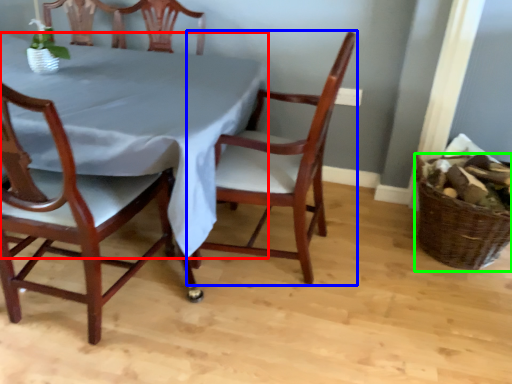
Question: Based on their relative distances, which object is nearer to tablecloth (highlighted by a red box)? Choose from chair (highlighted by a blue box) and basket (highlighted by a green box).

Choices:
 (A) chair
 (B) basket

Answer: (A)